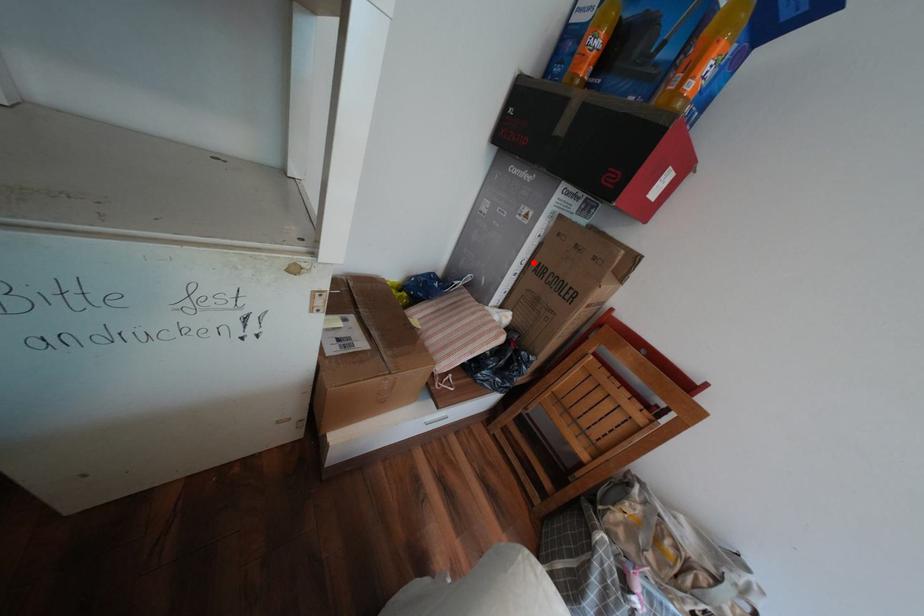
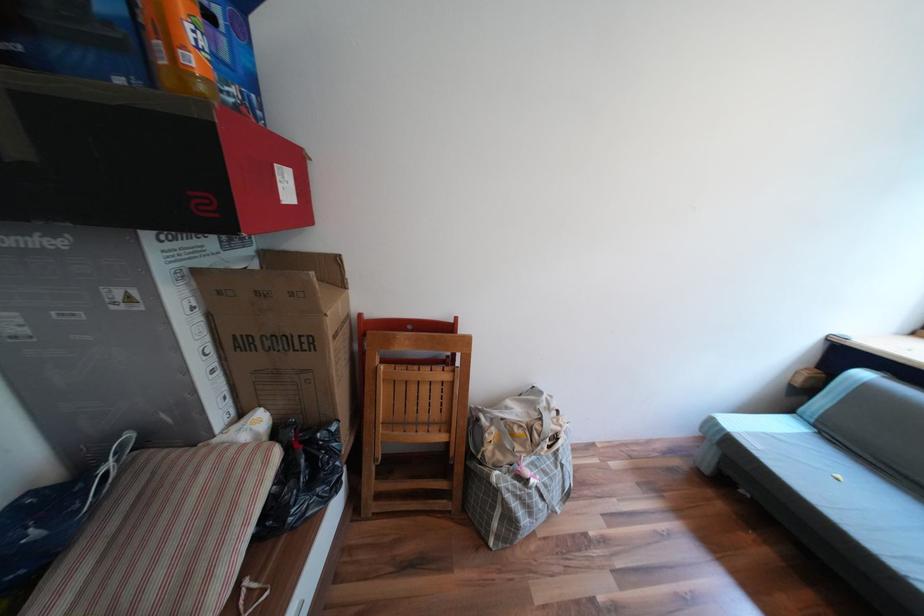
The point at the highlighted location is marked in the first image. Where is the corresponding point in the second image?

(219, 349)